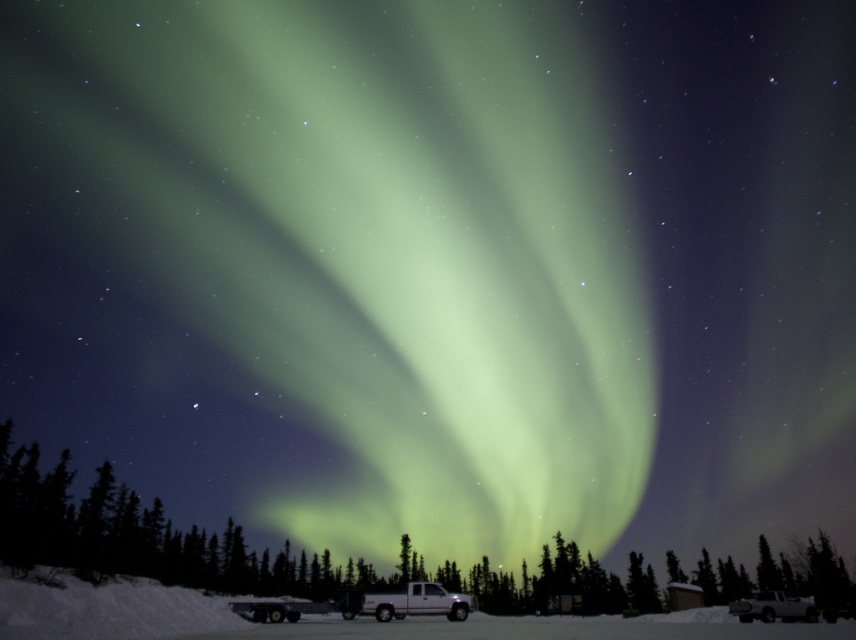
You are planning to tow a trailer with your vehicle. You see the white matte van at center and the white matte truck at lower right in the snowy landscape. Which vehicle is more suitable for towing based on their sizes?

The white matte truck at lower right is larger and therefore more suitable for towing the trailer compared to the white matte van at center.

You are planning to park your car behind the white matte van at center and the white matte truck at lower right. Which vehicle should you park behind to have more space on the sides?

You should park behind the white matte truck at lower right because it is wider than the white matte van at center, providing more space on the sides.